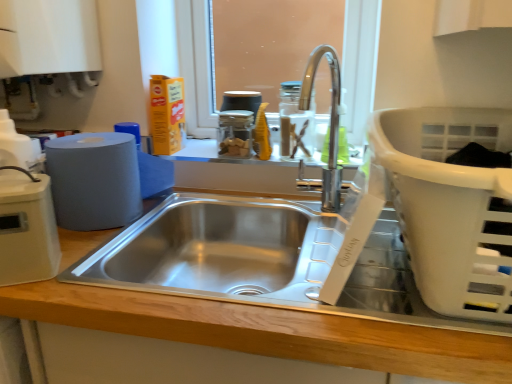
Question: Is clear glass jar at center at the right side of transparent glass jar at center, the second appliance from the front?

Choices:
 (A) yes
 (B) no

Answer: (A)

Question: Can you confirm if clear glass jar at center is wider than transparent glass jar at center, the first appliance viewed from the right?

Choices:
 (A) no
 (B) yes

Answer: (A)

Question: Is transparent glass jar at center, the first appliance positioned from the top, at the back of clear glass jar at center?

Choices:
 (A) no
 (B) yes

Answer: (A)

Question: Considering the relative sizes of clear glass jar at center and transparent glass jar at center, which is the second appliance from left to right, in the image provided, is clear glass jar at center thinner than transparent glass jar at center, which is the second appliance from left to right,?

Choices:
 (A) no
 (B) yes

Answer: (B)

Question: From the image's perspective, is clear glass jar at center under transparent glass jar at center, the first appliance in the back-to-front sequence?

Choices:
 (A) yes
 (B) no

Answer: (B)

Question: From a real-world perspective, is clear glass jar at center above or below beige plastic toaster at left, the first appliance when ordered from left to right?

Choices:
 (A) below
 (B) above

Answer: (B)

Question: From the image's perspective, relative to beige plastic toaster at left, the first appliance when ordered from left to right, is clear glass jar at center above or below?

Choices:
 (A) above
 (B) below

Answer: (A)

Question: Is clear glass jar at center taller or shorter than beige plastic toaster at left, the first appliance when ordered from left to right?

Choices:
 (A) tall
 (B) short

Answer: (B)

Question: Is clear glass jar at center wider or thinner than beige plastic toaster at left, which is the 2th appliance from top to bottom?

Choices:
 (A) wide
 (B) thin

Answer: (B)

Question: Is clear glass jar at center situated inside transparent glass window screen at upper center or outside?

Choices:
 (A) outside
 (B) inside

Answer: (A)

Question: From a real-world perspective, relative to transparent glass window screen at upper center, is clear glass jar at center vertically above or below?

Choices:
 (A) above
 (B) below

Answer: (B)

Question: Is clear glass jar at center in front of or behind transparent glass window screen at upper center in the image?

Choices:
 (A) front
 (B) behind

Answer: (A)

Question: Is clear glass jar at center bigger or smaller than transparent glass window screen at upper center?

Choices:
 (A) small
 (B) big

Answer: (A)

Question: Based on their sizes in the image, would you say wooden counter at center is bigger or smaller than matte gray paper towel at left?

Choices:
 (A) small
 (B) big

Answer: (B)

Question: From the image's perspective, is wooden counter at center located above or below matte gray paper towel at left?

Choices:
 (A) below
 (B) above

Answer: (A)